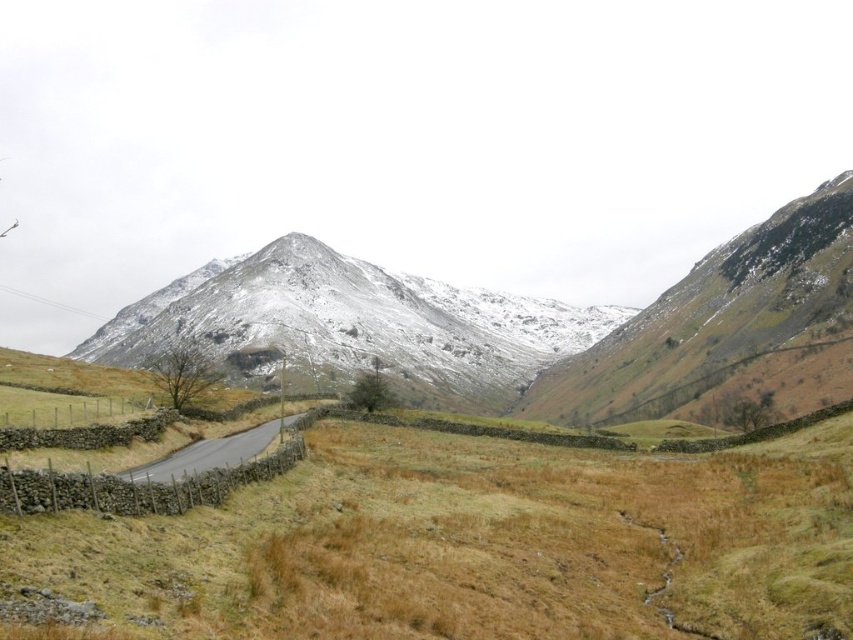
Question: Which point is farther to the camera?

Choices:
 (A) black asphalt road at center
 (B) snowy rock mountain at center

Answer: (B)

Question: Is snowy rock mountain at center wider than black asphalt road at center?

Choices:
 (A) no
 (B) yes

Answer: (B)

Question: Is snowy rock mountain at center below black asphalt road at center?

Choices:
 (A) no
 (B) yes

Answer: (A)

Question: Is snowy rock mountain at center to the right of black asphalt road at center from the viewer's perspective?

Choices:
 (A) yes
 (B) no

Answer: (A)

Question: Which point is closer to the camera?

Choices:
 (A) (241, 458)
 (B) (328, 296)

Answer: (A)